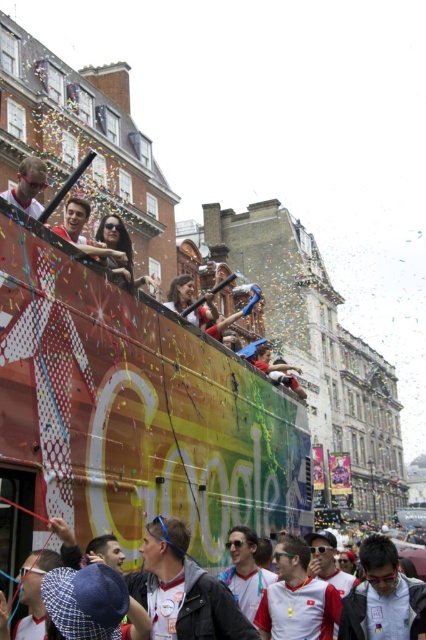
Between point (396, 634) and point (36, 170), which one is positioned in front?

Point (396, 634)

Describe the element at coordinates (382, 596) in the screenshot. The height and width of the screenshot is (640, 426). I see `matte black sunglasses at center` at that location.

Where is `matte black sunglasses at center`? matte black sunglasses at center is located at coordinates (382, 596).

Can you confirm if multicolored painted bus at upper center is positioned below matte red shirt at center?

Indeed, multicolored painted bus at upper center is positioned under matte red shirt at center.

Between point (62, 499) and point (195, 316), which one is positioned behind?

Positioned behind is point (195, 316).

At what (x,y) coordinates should I click in order to perform the action: click on multicolored painted bus at upper center. Please return your answer as a coordinate pair (x, y). Looking at the image, I should click on (129, 412).

What do you see at coordinates (183, 589) in the screenshot?
I see `black leather jacket at center` at bounding box center [183, 589].

Based on the photo, does black leather jacket at center have a larger size compared to white fabric shirt at center?

No, black leather jacket at center is not bigger than white fabric shirt at center.

Is point (146, 564) positioned behind point (264, 621)?

No, (146, 564) is in front of (264, 621).

Where is `black leather jacket at center`? This screenshot has width=426, height=640. black leather jacket at center is located at coordinates (183, 589).